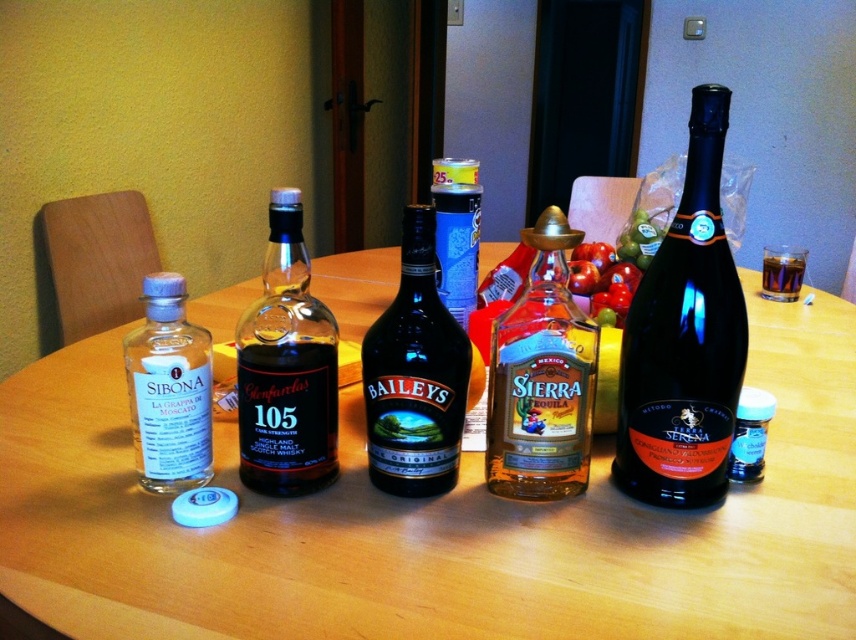
You are standing at the edge of the table looking towards the center. There are two points marked on the table surface labeled as point 1 and point 2. Point 1 is at coordinate (x=651, y=410) and point 2 is at (x=782, y=244). If you want to place a new item on the table between these two points, which point should you move towards from your current position to ensure the item is placed closer to the front of the table?

You should move towards point 1 at coordinate 0.641, 0.761 because it is in front of point 2 at (x=782, y=244). Since you want to place the item closer to the front of the table, moving towards point 1 will ensure the item is positioned nearer to the front.